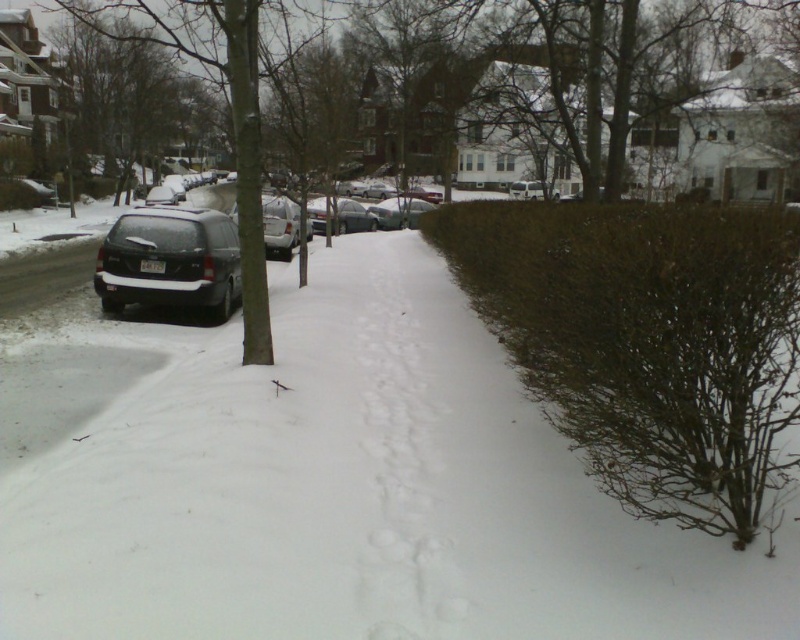
You are standing at the center of the snowy street and want to reach a point closer to you. Which point should you head towards, point (48, 490) or point (128, 232)?

Point (48, 490) is closer to the camera than point (128, 232), so you should head towards point (48, 490).